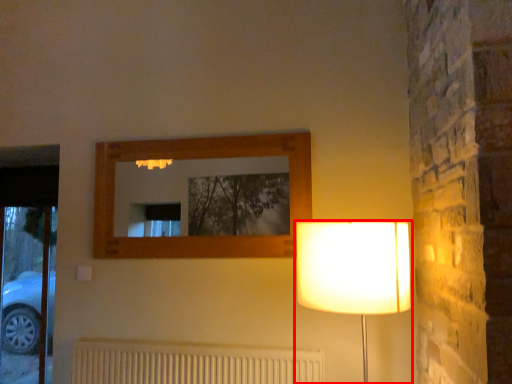
Question: Where is lamp (annotated by the red box) located in relation to radiator in the image?

Choices:
 (A) left
 (B) right

Answer: (B)